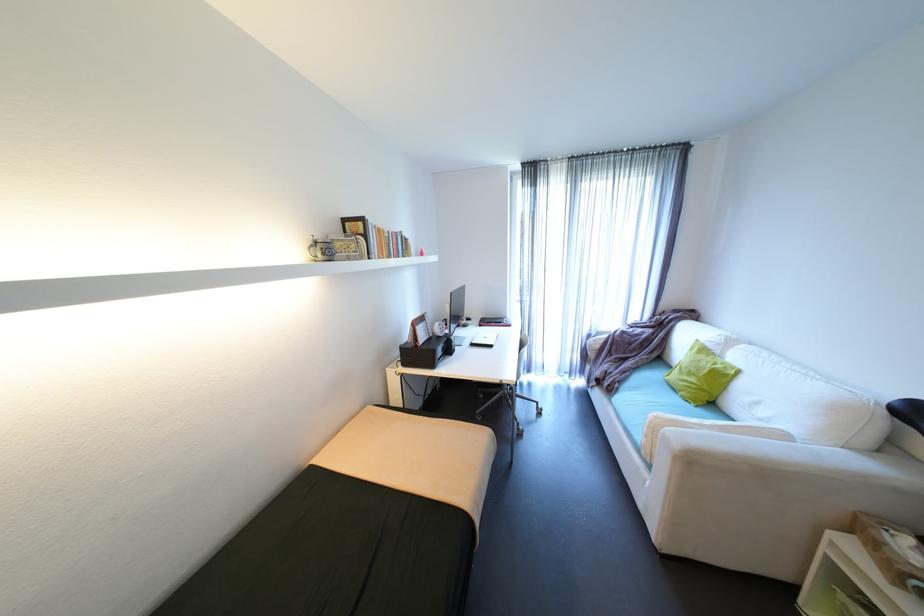
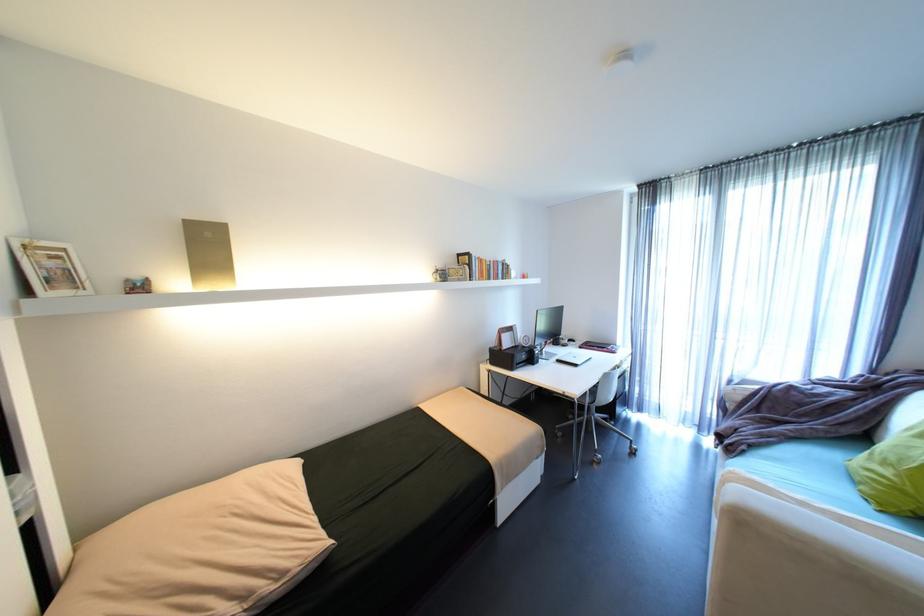
Where in the second image is the point corresponding to (x=625, y=387) from the first image?

(751, 451)